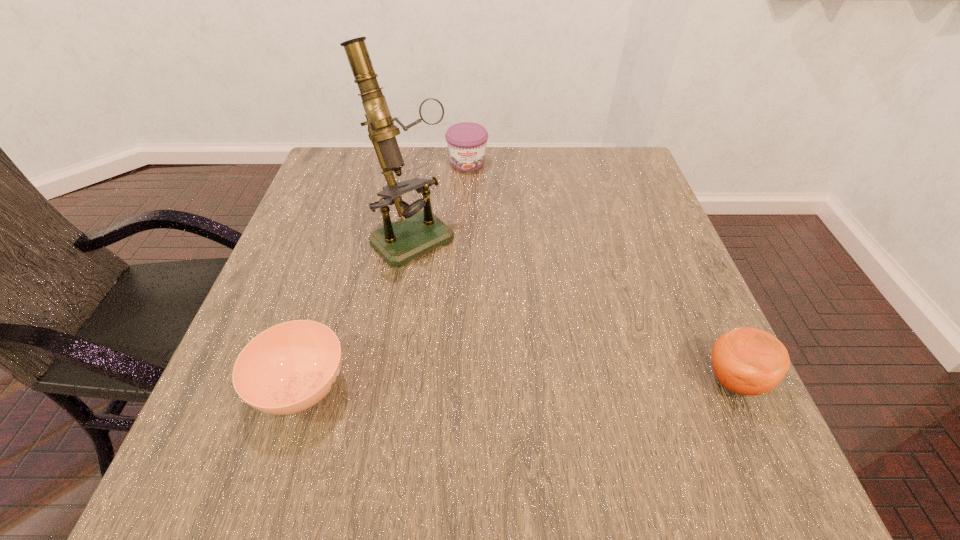
At what (x,y) coordinates should I click in order to perform the action: click on object that is positioned at the near left corner. Please return your answer as a coordinate pair (x, y). This screenshot has width=960, height=540. Looking at the image, I should click on (288, 368).

The width and height of the screenshot is (960, 540). Identify the location of object that is at the near right corner. pos(748,361).

Image resolution: width=960 pixels, height=540 pixels. I want to click on free space at the far edge, so click(517, 154).

Where is `vacant space at the left edge`? This screenshot has height=540, width=960. vacant space at the left edge is located at coordinates click(252, 315).

In the image, there is a desktop. What are the coordinates of `vacant space at the right edge` in the screenshot? It's located at (704, 303).

The width and height of the screenshot is (960, 540). Find the location of `free location at the far left corner of the desktop`. free location at the far left corner of the desktop is located at coordinates click(349, 177).

This screenshot has width=960, height=540. What are the coordinates of `vacant area at the far right corner` in the screenshot? It's located at (603, 161).

Find the location of a particular element. This screenshot has height=540, width=960. vacant space that is in between the shortest object and the jam is located at coordinates (385, 275).

This screenshot has height=540, width=960. What are the coordinates of `free space between the microscope and the shortest object` in the screenshot? It's located at (357, 312).

I want to click on vacant point located between the jam and the tallest object, so click(x=440, y=199).